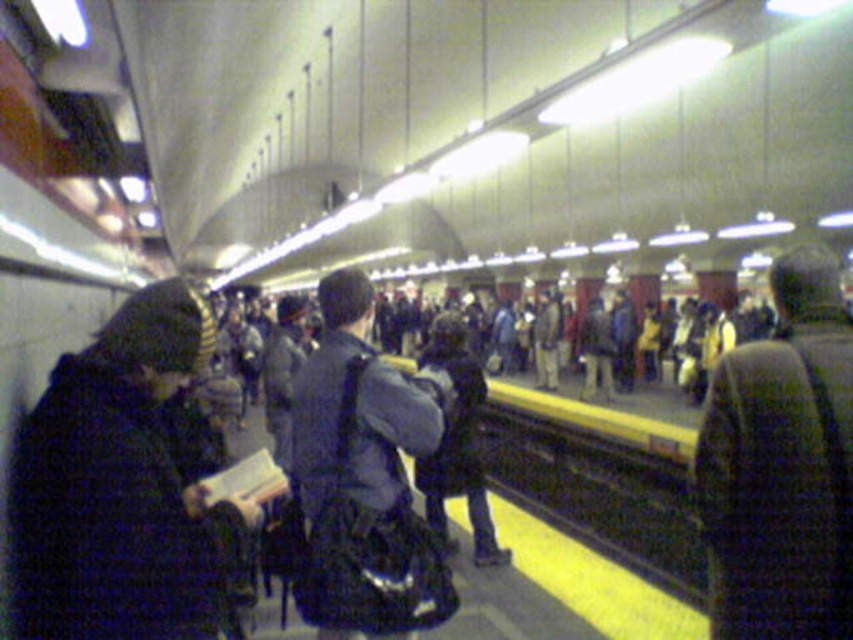
Between point (851, 593) and point (482, 493), which one is positioned in front?

Point (851, 593)

Does knitted wool hat at upper right have a smaller size compared to dark blue jacket at center?

Incorrect, knitted wool hat at upper right is not smaller in size than dark blue jacket at center.

Does point (831, 408) come closer to viewer compared to point (450, 467)?

That is True.

Image resolution: width=853 pixels, height=640 pixels. I want to click on knitted wool hat at upper right, so click(x=781, y=467).

Does point (161, 433) lie in front of point (833, 342)?

Yes.

Is black fuzzy coat at left shorter than knitted wool hat at upper right?

Correct, black fuzzy coat at left is not as tall as knitted wool hat at upper right.

Is point (215, 515) positioned before point (844, 609)?

Yes.

The width and height of the screenshot is (853, 640). Find the location of `black fuzzy coat at left`. black fuzzy coat at left is located at coordinates (120, 486).

Does dark blue backpack at center appear under dark blue jacket at center?

No, dark blue backpack at center is not below dark blue jacket at center.

Who is more forward, (x=399, y=529) or (x=462, y=420)?

Point (x=399, y=529)

Image resolution: width=853 pixels, height=640 pixels. I want to click on dark blue backpack at center, so click(363, 472).